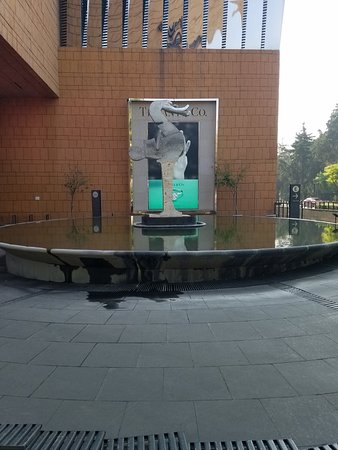
Identify the location of wall. The height and width of the screenshot is (450, 338). (242, 87).